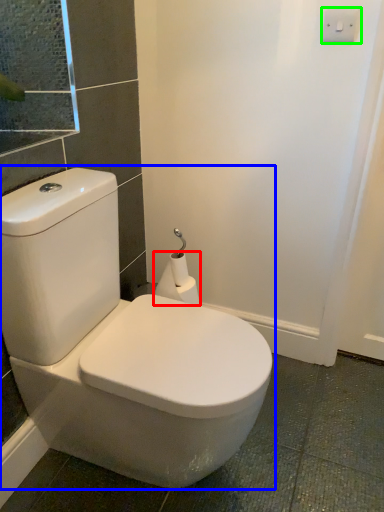
Question: Which object is positioned farthest from toilet paper (highlighted by a red box)? Select from toilet (highlighted by a blue box) and light switch (highlighted by a green box).

Choices:
 (A) toilet
 (B) light switch

Answer: (B)